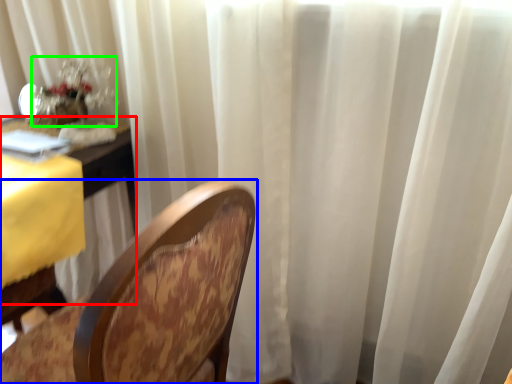
Question: Considering the real-world distances, which object is farthest from table (highlighted by a red box)? chair (highlighted by a blue box) or floral arrangement (highlighted by a green box)?

Choices:
 (A) chair
 (B) floral arrangement

Answer: (A)